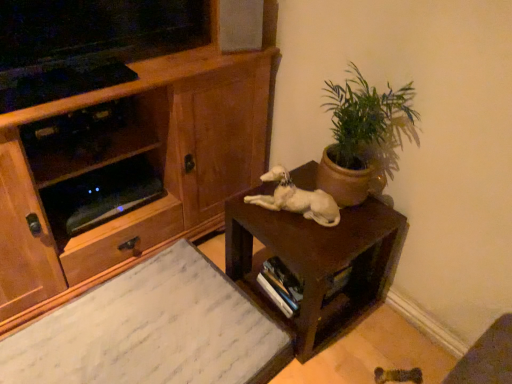
What do you see at coordinates (152, 331) in the screenshot? The width and height of the screenshot is (512, 384). I see `white marble desk at lower left` at bounding box center [152, 331].

Identify the location of wooden cabinet at left. (118, 137).

Locate an element on the screen. The width and height of the screenshot is (512, 384). green matte plant at upper right is located at coordinates tap(364, 137).

This screenshot has height=384, width=512. Identify the location of white marble desk at lower left. (152, 331).

Is white marble desk at lower left taller or shorter than wooden cabinet at left?

white marble desk at lower left is shorter than wooden cabinet at left.

Is white marble desk at lower left at the left side of wooden cabinet at left?

No.

Is white marble desk at lower left in front of or behind wooden cabinet at left in the image?

white marble desk at lower left is in front of wooden cabinet at left.

Between white glossy dog at center and green matte plant at upper right, which one has smaller width?

green matte plant at upper right is thinner.

From the image's perspective, which one is positioned higher, white glossy dog at center or green matte plant at upper right?

green matte plant at upper right.

Can you confirm if white glossy dog at center is positioned to the right of green matte plant at upper right?

No.

From a real-world perspective, relative to green matte plant at upper right, is white glossy dog at center vertically above or below?

white glossy dog at center is below green matte plant at upper right.

From the image's perspective, between green matte plant at upper right and brown matte table at center, who is located below?

brown matte table at center appears lower in the image.

Can you confirm if green matte plant at upper right is smaller than brown matte table at center?

Yes.

Is green matte plant at upper right not near brown matte table at center?

green matte plant at upper right is actually quite close to brown matte table at center.

Is brown matte table at center inside green matte plant at upper right?

No, brown matte table at center is located outside of green matte plant at upper right.

Who is smaller, white glossy dog at center or white marble desk at lower left?

white glossy dog at center.

Identify the location of desk to the left of white glossy dog at center. (152, 331).

Does white glossy dog at center appear on the left side of white marble desk at lower left?

In fact, white glossy dog at center is to the right of white marble desk at lower left.

Could you tell me if white glossy dog at center is facing white marble desk at lower left?

No, white glossy dog at center is not aimed at white marble desk at lower left.

Where is `cabinetry below the green matte plant at upper right (from a real-world perspective)`? cabinetry below the green matte plant at upper right (from a real-world perspective) is located at coordinates (118, 137).

Who is shorter, wooden cabinet at left or green matte plant at upper right?

Standing shorter between the two is green matte plant at upper right.

Is wooden cabinet at left looking in the opposite direction of green matte plant at upper right?

No.

Can you confirm if wooden cabinet at left is positioned to the left of green matte plant at upper right?

Indeed, wooden cabinet at left is positioned on the left side of green matte plant at upper right.

How much distance is there between white marble desk at lower left and green matte plant at upper right?

white marble desk at lower left and green matte plant at upper right are 26.35 inches apart from each other.

Which is more to the left, white marble desk at lower left or green matte plant at upper right?

From the viewer's perspective, white marble desk at lower left appears more on the left side.

Is white marble desk at lower left taller or shorter than green matte plant at upper right?

In the image, white marble desk at lower left appears to be shorter than green matte plant at upper right.

From the image's perspective, which one is positioned lower, white marble desk at lower left or green matte plant at upper right?

white marble desk at lower left.

From a real-world perspective, is wooden cabinet at left physically below brown matte table at center?

No, from a real-world perspective, wooden cabinet at left is not under brown matte table at center.

Which object is wider, wooden cabinet at left or brown matte table at center?

wooden cabinet at left is wider.

Consider the image. Based on their positions, is wooden cabinet at left located to the left or right of brown matte table at center?

Based on their positions, wooden cabinet at left is located to the left of brown matte table at center.

Is wooden cabinet at left positioned with its back to brown matte table at center?

No, wooden cabinet at left is not facing away from brown matte table at center.

What are the coordinates of `cabinetry above the white marble desk at lower left (from the image's perspective)` in the screenshot? It's located at (118, 137).

This screenshot has height=384, width=512. In order to click on houseplant above the white glossy dog at center (from a real-world perspective) in this screenshot , I will do `click(364, 137)`.

Estimate the real-world distances between objects in this image. Which object is closer to white marble desk at lower left, white glossy dog at center or wooden cabinet at left?

Among the two, wooden cabinet at left is located nearer to white marble desk at lower left.

Consider the image. Which object lies nearer to the anchor point white marble desk at lower left, wooden cabinet at left or green matte plant at upper right?

Among the two, wooden cabinet at left is located nearer to white marble desk at lower left.

When comparing their distances from green matte plant at upper right, does brown matte table at center or white glossy dog at center seem further?

Based on the image, brown matte table at center appears to be further to green matte plant at upper right.

Estimate the real-world distances between objects in this image. Which object is further from green matte plant at upper right, white marble desk at lower left or brown matte table at center?

Among the two, white marble desk at lower left is located further to green matte plant at upper right.

Estimate the real-world distances between objects in this image. Which object is closer to wooden cabinet at left, green matte plant at upper right or brown matte table at center?

Based on the image, brown matte table at center appears to be nearer to wooden cabinet at left.

Based on the photo, considering their positions, is brown matte table at center positioned closer to white glossy dog at center than green matte plant at upper right?

green matte plant at upper right lies closer to white glossy dog at center than the other object.

Considering their positions, is wooden cabinet at left positioned closer to brown matte table at center than white marble desk at lower left?

white marble desk at lower left lies closer to brown matte table at center than the other object.

From the image, which object appears to be nearer to white glossy dog at center, wooden cabinet at left or green matte plant at upper right?

green matte plant at upper right lies closer to white glossy dog at center than the other object.

The image size is (512, 384). In order to click on animal between green matte plant at upper right and brown matte table at center from top to bottom in this screenshot , I will do `click(297, 199)`.

In order to click on table between white marble desk at lower left and green matte plant at upper right from left to right in this screenshot , I will do `click(316, 263)`.

Find the location of a particular element. The image size is (512, 384). desk between wooden cabinet at left and green matte plant at upper right in the horizontal direction is located at coordinates (152, 331).

Image resolution: width=512 pixels, height=384 pixels. I want to click on animal between wooden cabinet at left and brown matte table at center, so click(x=297, y=199).